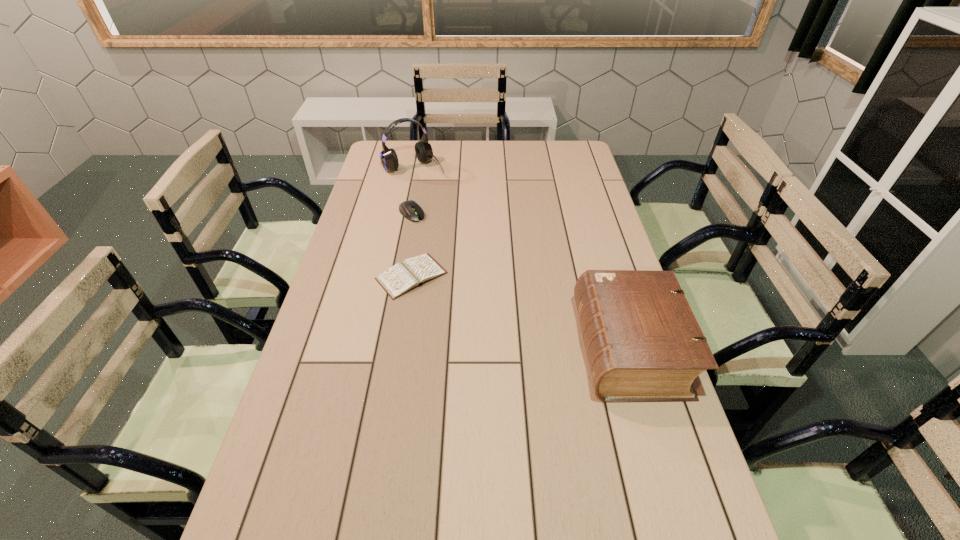
This screenshot has height=540, width=960. Find the location of `computer mouse that is positioned at the left edge`. computer mouse that is positioned at the left edge is located at coordinates (409, 209).

Identify the location of headset present at the left edge. (389, 160).

Image resolution: width=960 pixels, height=540 pixels. Find the location of `object at the right edge`. object at the right edge is located at coordinates (643, 342).

Where is `object that is at the far left corner`? The width and height of the screenshot is (960, 540). object that is at the far left corner is located at coordinates (389, 160).

This screenshot has height=540, width=960. I want to click on free spot at the far edge of the desktop, so click(529, 146).

Where is `vacant space at the left edge of the desktop`? The width and height of the screenshot is (960, 540). vacant space at the left edge of the desktop is located at coordinates (352, 403).

At what (x,y) coordinates should I click in order to perform the action: click on free location at the right edge of the desktop. Please return your answer as a coordinate pair (x, y). The width and height of the screenshot is (960, 540). Looking at the image, I should click on (572, 226).

Locate an element on the screen. The image size is (960, 540). free space at the far left corner of the desktop is located at coordinates (406, 168).

Identify the location of free space at the near left corner. This screenshot has height=540, width=960. (292, 511).

In the image, there is a desktop. What are the coordinates of `vacant space at the far right corner` in the screenshot? It's located at (568, 150).